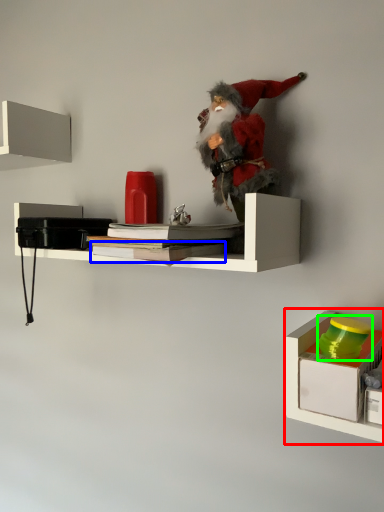
Question: Which object is positioned farthest from shelf (highlighted by a red box)? Select from book (highlighted by a blue box) and toy (highlighted by a green box).

Choices:
 (A) book
 (B) toy

Answer: (A)